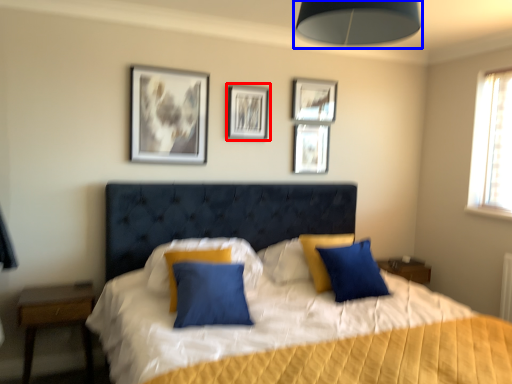
Question: Which object is closer to the camera taking this photo, picture frame (highlighted by a red box) or lamp (highlighted by a blue box)?

Choices:
 (A) picture frame
 (B) lamp

Answer: (B)